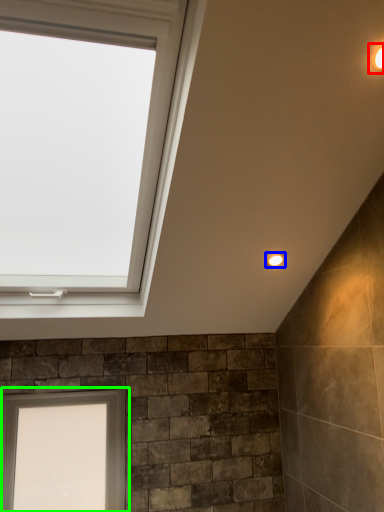
Question: Considering the real-world distances, which object is closest to light fixture (highlighted by a red box)? light fixture (highlighted by a blue box) or window (highlighted by a green box).

Choices:
 (A) light fixture
 (B) window

Answer: (A)